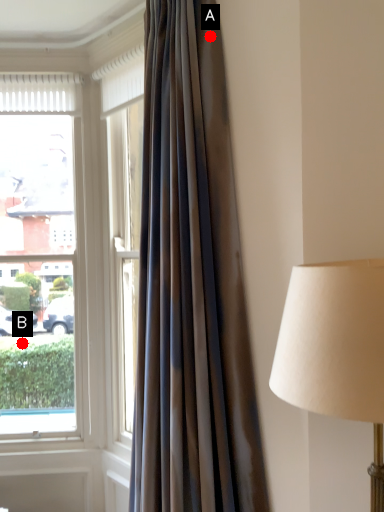
Question: Two points are circled on the image, labeled by A and B beside each circle. Which of the following is the farthest from the observer?

Choices:
 (A) A is further
 (B) B is further

Answer: (B)